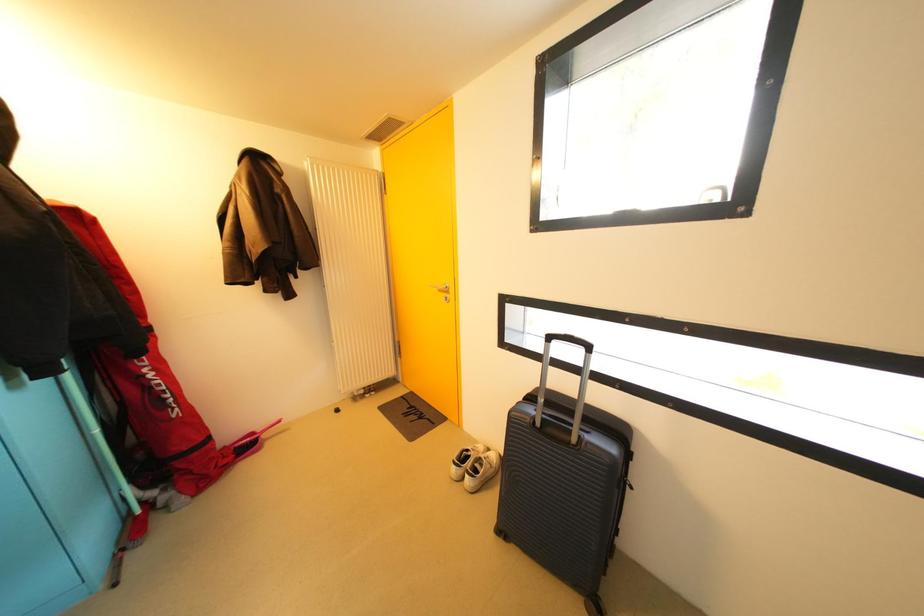
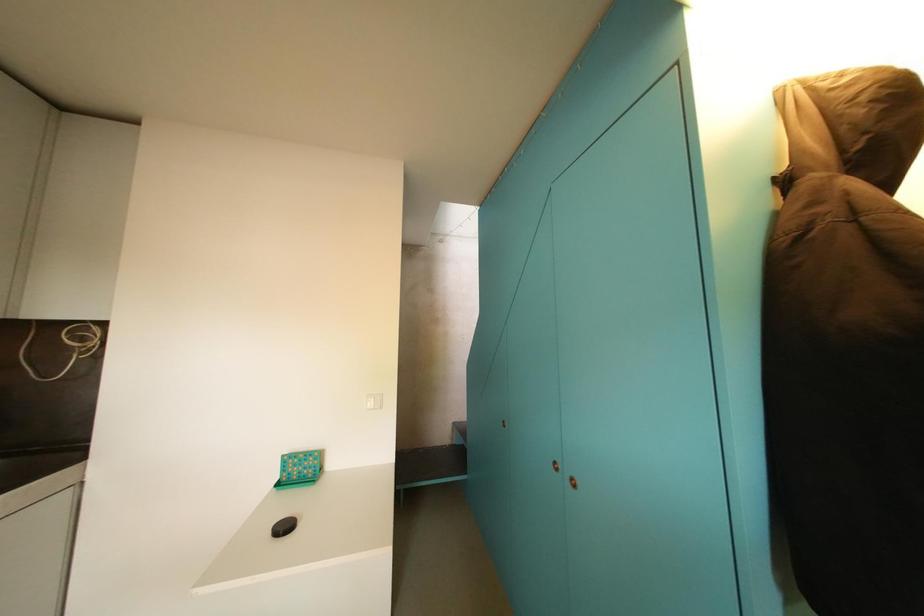
Question: The camera is either moving clockwise (left) or counter-clockwise (right) around the object. The first image is from the beginning of the video and the second image is from the end. Is the camera moving left or right when shooting the video?

Choices:
 (A) Left
 (B) Right

Answer: (B)